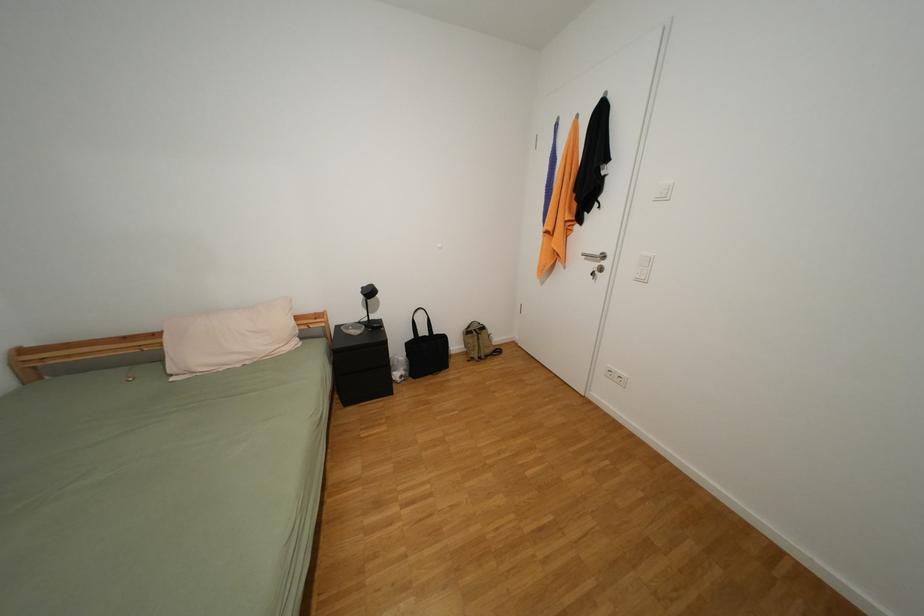
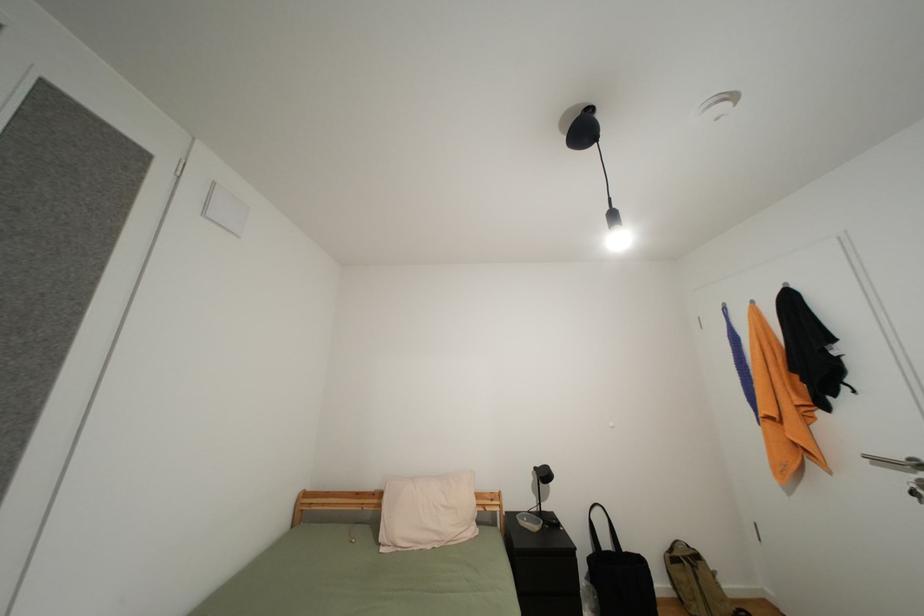
The images are taken continuously from a first-person perspective. In which direction is your viewpoint rotating?

The rotation direction of the camera is left-up.